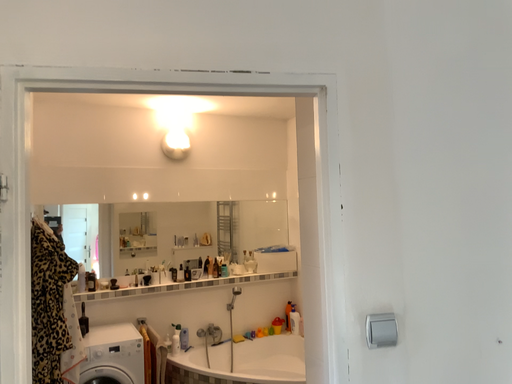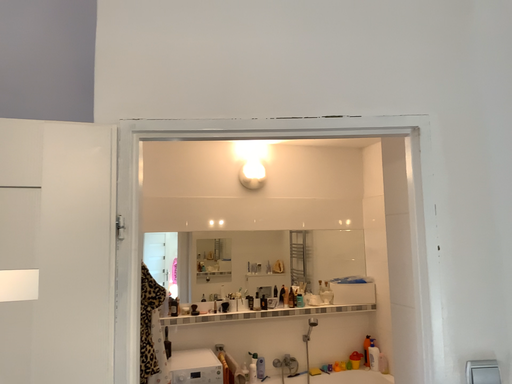
Question: Which way did the camera rotate in the video?

Choices:
 (A) rotated left
 (B) rotated right

Answer: (A)